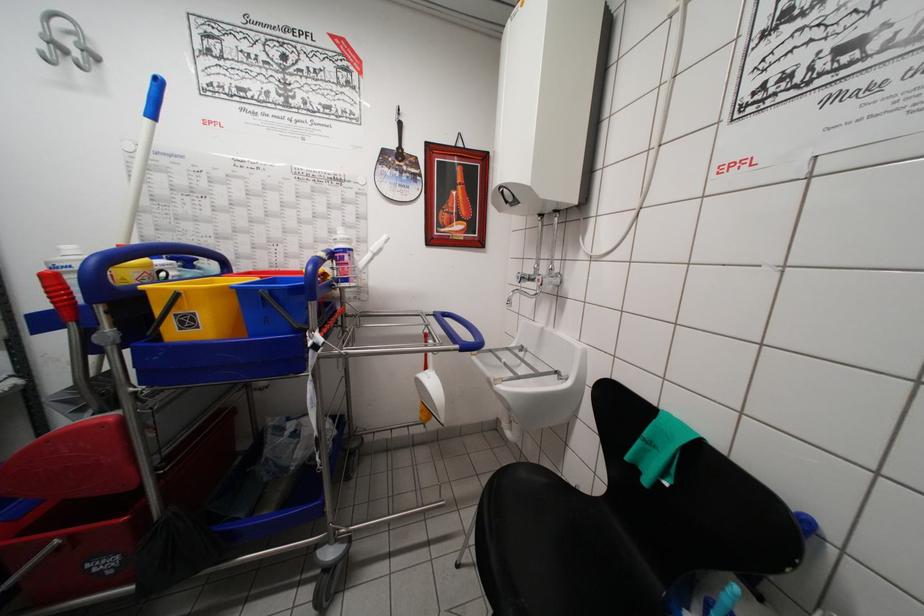
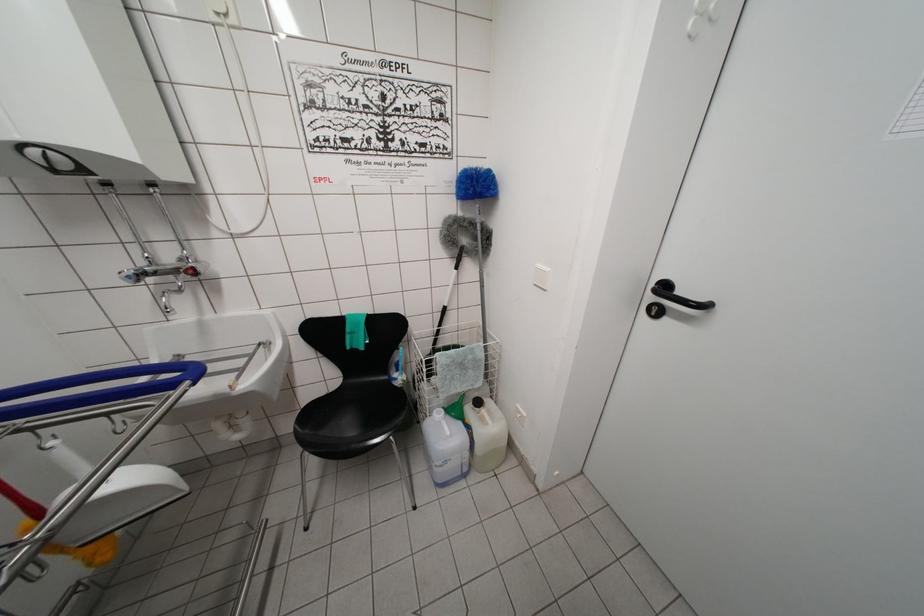
Locate, in the second image, the point that corresponds to (x=521, y=282) in the first image.

(131, 282)